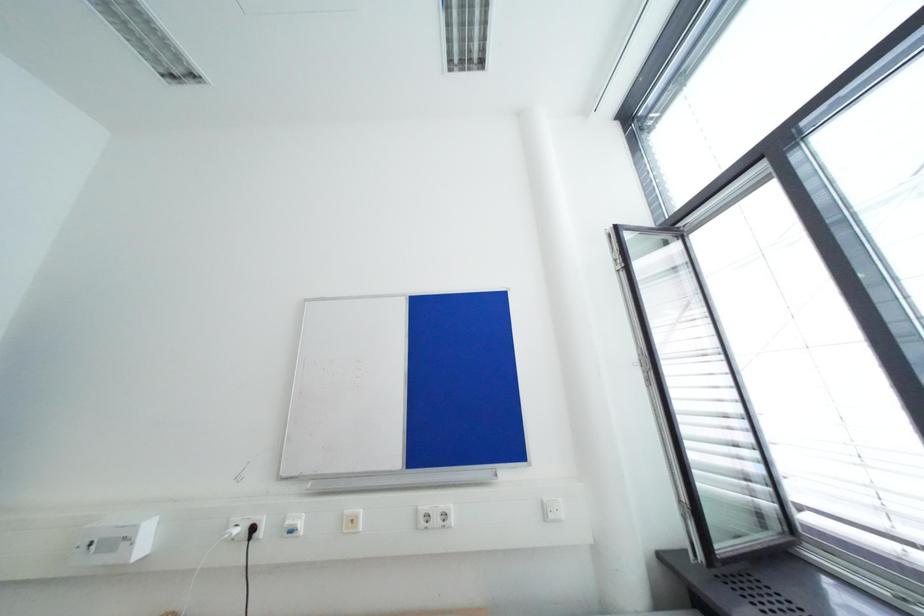
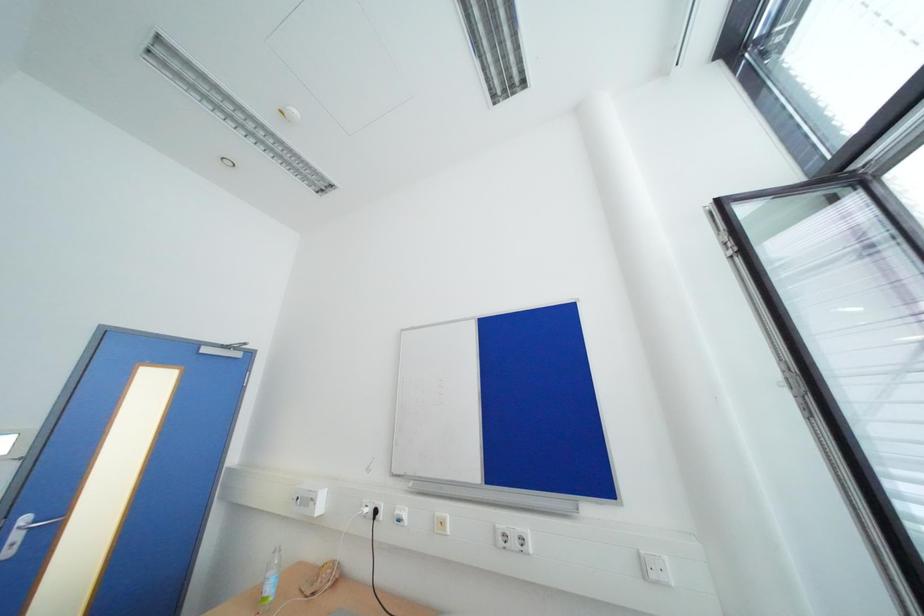
Question: What movement of the cameraman would produce the second image?

Choices:
 (A) Left
 (B) Right
 (C) Forward
 (D) Backward

Answer: (B)